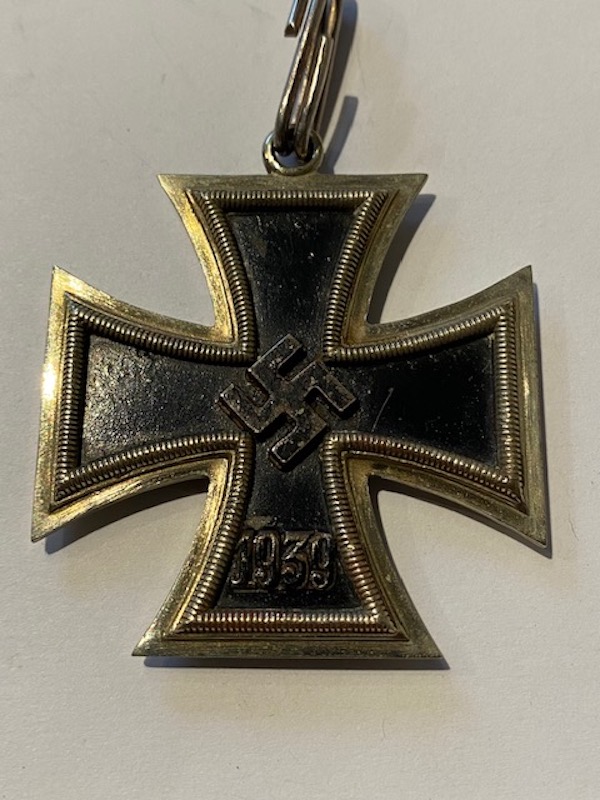
I want to click on hook, so click(328, 66).